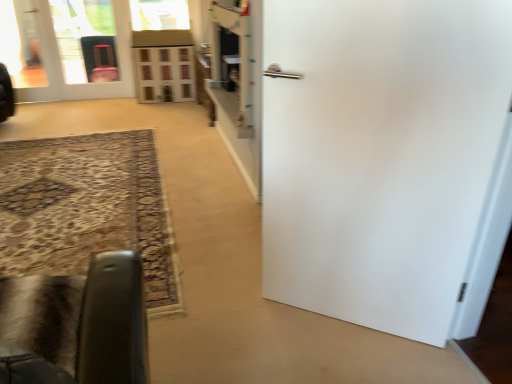
Question: From a real-world perspective, does matte white door at upper left, placed as the first door when sorted from top to bottom, sit lower than velvet black chair at lower left?

Choices:
 (A) no
 (B) yes

Answer: (A)

Question: From the image's perspective, does matte white door at upper left, placed as the first door when sorted from top to bottom, appear lower than velvet black chair at lower left?

Choices:
 (A) yes
 (B) no

Answer: (B)

Question: Is matte white door at upper left, the 2th door when ordered from front to back, not within velvet black chair at lower left?

Choices:
 (A) yes
 (B) no

Answer: (A)

Question: From the image's perspective, is matte white door at upper left, placed as the first door when sorted from top to bottom, on velvet black chair at lower left?

Choices:
 (A) no
 (B) yes

Answer: (B)

Question: Is matte white door at upper left, placed as the first door when sorted from back to front, looking in the opposite direction of velvet black chair at lower left?

Choices:
 (A) yes
 (B) no

Answer: (B)

Question: Considering the relative positions of velvet black chair at lower left and matte white door at upper left, placed as the first door when sorted from back to front, in the image provided, is velvet black chair at lower left to the left or to the right of matte white door at upper left, placed as the first door when sorted from back to front,?

Choices:
 (A) right
 (B) left

Answer: (A)

Question: From a real-world perspective, is velvet black chair at lower left physically located above or below matte white door at upper left, placed as the first door when sorted from back to front?

Choices:
 (A) above
 (B) below

Answer: (B)

Question: Would you say velvet black chair at lower left is inside or outside matte white door at upper left, placed as the first door when sorted from top to bottom?

Choices:
 (A) inside
 (B) outside

Answer: (B)

Question: Considering the positions of velvet black chair at lower left and matte white door at upper left, the 2th door when ordered from front to back, in the image, is velvet black chair at lower left wider or thinner than matte white door at upper left, the 2th door when ordered from front to back,?

Choices:
 (A) wide
 (B) thin

Answer: (A)

Question: Considering the positions of wooden dollhouse at center and matte white door at upper left, placed as the first door when sorted from top to bottom, in the image, is wooden dollhouse at center bigger or smaller than matte white door at upper left, placed as the first door when sorted from top to bottom,?

Choices:
 (A) small
 (B) big

Answer: (A)

Question: Is point (138, 91) positioned closer to the camera than point (54, 49)?

Choices:
 (A) farther
 (B) closer

Answer: (A)

Question: From their relative heights in the image, would you say wooden dollhouse at center is taller or shorter than matte white door at upper left, positioned as the 2th door in bottom-to-top order?

Choices:
 (A) short
 (B) tall

Answer: (A)

Question: From the image's perspective, relative to matte white door at upper left, positioned as the 2th door in bottom-to-top order, is wooden dollhouse at center above or below?

Choices:
 (A) below
 (B) above

Answer: (A)

Question: In the image, is wooden dollhouse at center on the left side or the right side of velvet black chair at lower left?

Choices:
 (A) right
 (B) left

Answer: (B)

Question: Considering the positions of point (172, 59) and point (69, 337), is point (172, 59) closer or farther from the camera than point (69, 337)?

Choices:
 (A) closer
 (B) farther

Answer: (B)